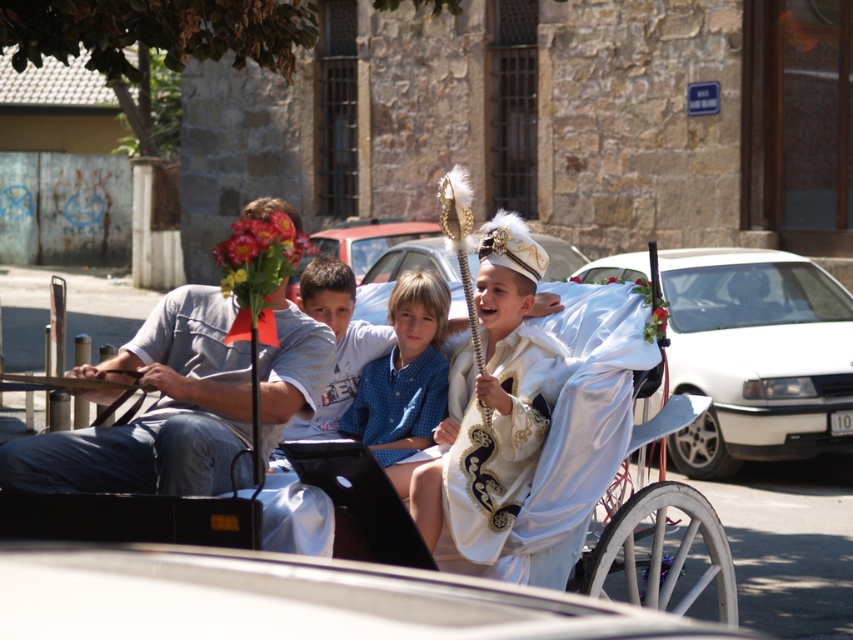
Does white satin horse cart at center lie in front of light blue shirt at center?

Yes, white satin horse cart at center is closer to the viewer.

Is white satin horse cart at center smaller than light blue shirt at center?

Incorrect, white satin horse cart at center is not smaller in size than light blue shirt at center.

Does point (363, 625) lie behind point (328, 432)?

No, (363, 625) is in front of (328, 432).

Where is `white satin horse cart at center`? The height and width of the screenshot is (640, 853). white satin horse cart at center is located at coordinates (286, 598).

Is white satin horse cart at center further to camera compared to gray cotton shirt at left?

No, white satin horse cart at center is in front of gray cotton shirt at left.

Can you confirm if white satin horse cart at center is taller than gray cotton shirt at left?

Indeed, white satin horse cart at center has a greater height compared to gray cotton shirt at left.

The image size is (853, 640). What are the coordinates of `white satin horse cart at center` in the screenshot? It's located at (286, 598).

Looking at this image, between white satin horse cart at center and blue checkered shirt at center, which one has less height?

With less height is blue checkered shirt at center.

Is point (438, 576) farther from camera compared to point (384, 396)?

No.

Between point (16, 582) and point (445, 301), which one is positioned behind?

Positioned behind is point (445, 301).

The height and width of the screenshot is (640, 853). I want to click on white satin horse cart at center, so click(x=286, y=598).